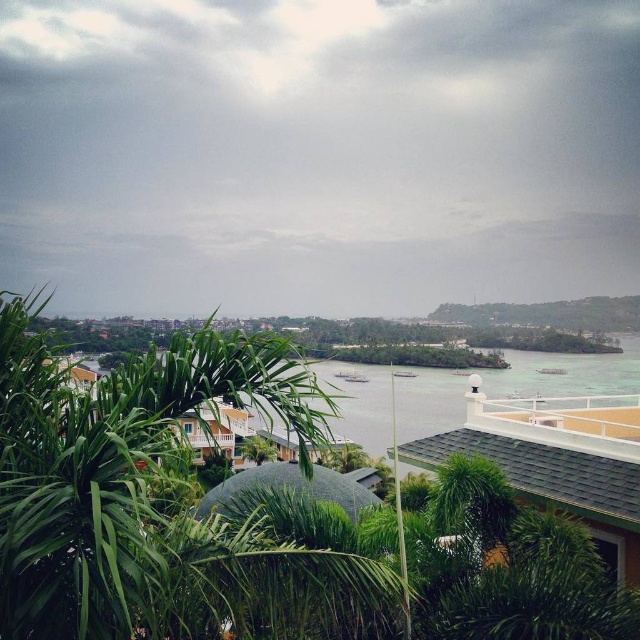
Question: Considering the relative positions of green leafy vegetation at center and clear water at center in the image provided, where is green leafy vegetation at center located with respect to clear water at center?

Choices:
 (A) below
 (B) above

Answer: (B)

Question: Among these points, which one is farthest from the camera?

Choices:
 (A) (48, 394)
 (B) (387, 429)

Answer: (B)

Question: Which object appears closest to the camera in this image?

Choices:
 (A) clear water at center
 (B) green leafy vegetation at center

Answer: (B)

Question: Which of the following is the closest to the observer?

Choices:
 (A) (390, 592)
 (B) (445, 403)

Answer: (A)

Question: Is green leafy vegetation at center smaller than clear water at center?

Choices:
 (A) no
 (B) yes

Answer: (B)

Question: Is the position of green leafy vegetation at center more distant than that of clear water at center?

Choices:
 (A) yes
 (B) no

Answer: (B)